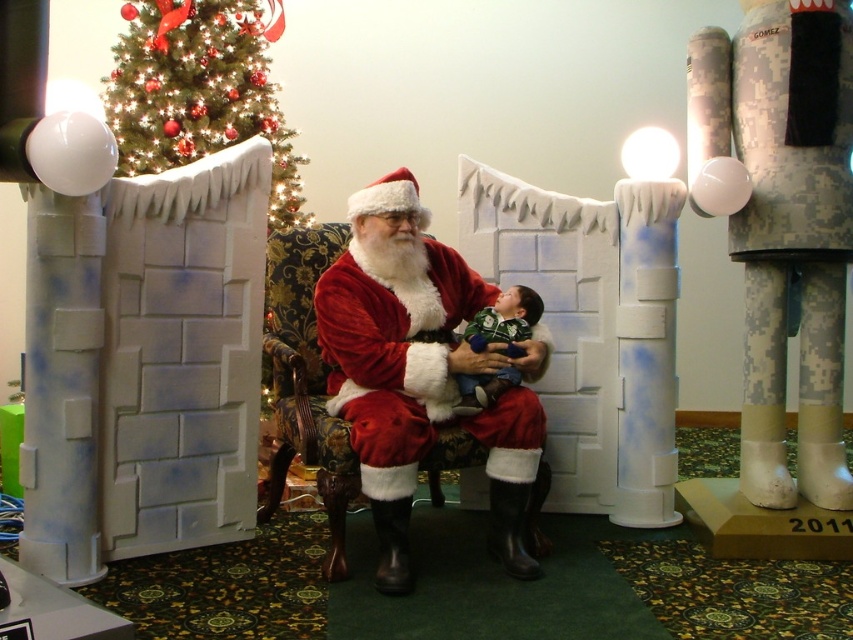
Question: Is velvet red santa at center thinner than green fuzzy sweater at center?

Choices:
 (A) no
 (B) yes

Answer: (A)

Question: Where is velvet red santa at center located in relation to green fuzzy sweater at center in the image?

Choices:
 (A) above
 (B) below

Answer: (B)

Question: Among these objects, which one is nearest to the camera?

Choices:
 (A) velvet red santa at center
 (B) green fuzzy sweater at center
 (C) green matte christmas tree at upper left
 (D) camouflage fabric santa at center

Answer: (A)

Question: Which object appears farthest from the camera in this image?

Choices:
 (A) velvet red santa at center
 (B) green fuzzy sweater at center

Answer: (B)

Question: Which object is the closest to the camouflage fabric santa at center?

Choices:
 (A) green fuzzy sweater at center
 (B) green matte christmas tree at upper left

Answer: (A)

Question: Can you confirm if green matte christmas tree at upper left is positioned below green fuzzy sweater at center?

Choices:
 (A) no
 (B) yes

Answer: (A)